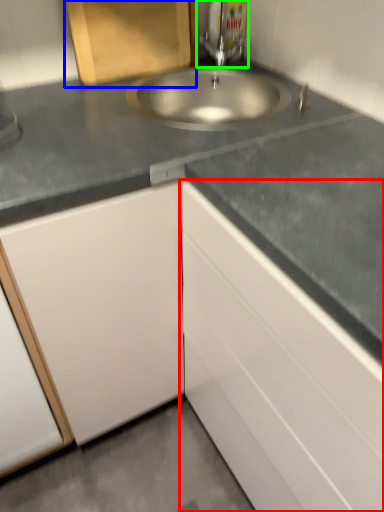
Question: Which object is positioned farthest from cabinetry (highlighted by a red box)? Select from cabinetry (highlighted by a blue box) and tap (highlighted by a green box).

Choices:
 (A) cabinetry
 (B) tap

Answer: (B)